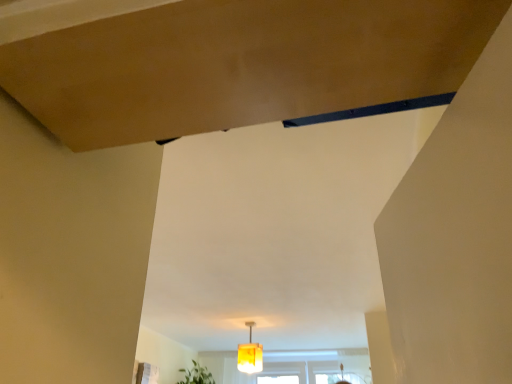
Question: Is translucent yellow lampshade at center located within green leafy plant at lower center?

Choices:
 (A) yes
 (B) no

Answer: (B)

Question: From the image's perspective, is green leafy plant at lower center over translucent yellow lampshade at center?

Choices:
 (A) yes
 (B) no

Answer: (B)

Question: Is green leafy plant at lower center outside translucent yellow lampshade at center?

Choices:
 (A) no
 (B) yes

Answer: (B)

Question: Is green leafy plant at lower center further to the viewer compared to translucent yellow lampshade at center?

Choices:
 (A) yes
 (B) no

Answer: (A)

Question: From a real-world perspective, does green leafy plant at lower center sit lower than translucent yellow lampshade at center?

Choices:
 (A) yes
 (B) no

Answer: (A)

Question: Is green leafy plant at lower center positioned with its back to translucent yellow lampshade at center?

Choices:
 (A) yes
 (B) no

Answer: (B)

Question: Are translucent yellow lampshade at center and green leafy plant at lower center located far from each other?

Choices:
 (A) yes
 (B) no

Answer: (A)

Question: Is translucent yellow lampshade at center outside of green leafy plant at lower center?

Choices:
 (A) no
 (B) yes

Answer: (B)

Question: Is translucent yellow lampshade at center smaller than green leafy plant at lower center?

Choices:
 (A) yes
 (B) no

Answer: (A)

Question: Is translucent yellow lampshade at center to the right of green leafy plant at lower center from the viewer's perspective?

Choices:
 (A) yes
 (B) no

Answer: (A)

Question: From the image's perspective, is translucent yellow lampshade at center over green leafy plant at lower center?

Choices:
 (A) yes
 (B) no

Answer: (A)

Question: Is green leafy plant at lower center surrounded by translucent yellow lampshade at center?

Choices:
 (A) yes
 (B) no

Answer: (B)

Question: Is green leafy plant at lower center wider or thinner than translucent yellow lampshade at center?

Choices:
 (A) wide
 (B) thin

Answer: (A)